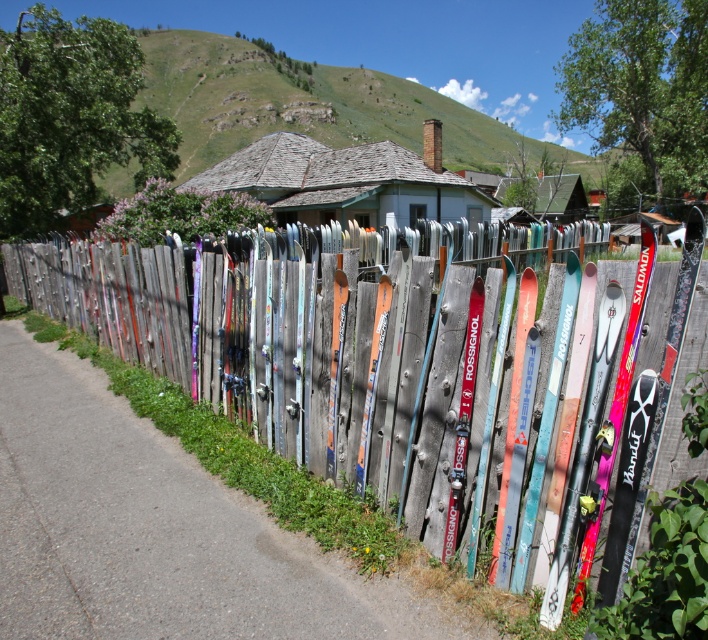
Question: Is wooden skis at center to the left of gray shingled house at center from the viewer's perspective?

Choices:
 (A) no
 (B) yes

Answer: (A)

Question: Among these points, which one is farthest from the camera?

Choices:
 (A) (142, 358)
 (B) (280, 216)

Answer: (B)

Question: Can you confirm if wooden skis at center is positioned below gray shingled house at center?

Choices:
 (A) yes
 (B) no

Answer: (A)

Question: Does wooden skis at center come in front of gray shingled house at center?

Choices:
 (A) yes
 (B) no

Answer: (A)

Question: Which of the following is the farthest from the observer?

Choices:
 (A) gray shingled house at center
 (B) wooden skis at center

Answer: (A)

Question: Among these points, which one is nearest to the camera?

Choices:
 (A) (227, 170)
 (B) (459, 332)

Answer: (B)